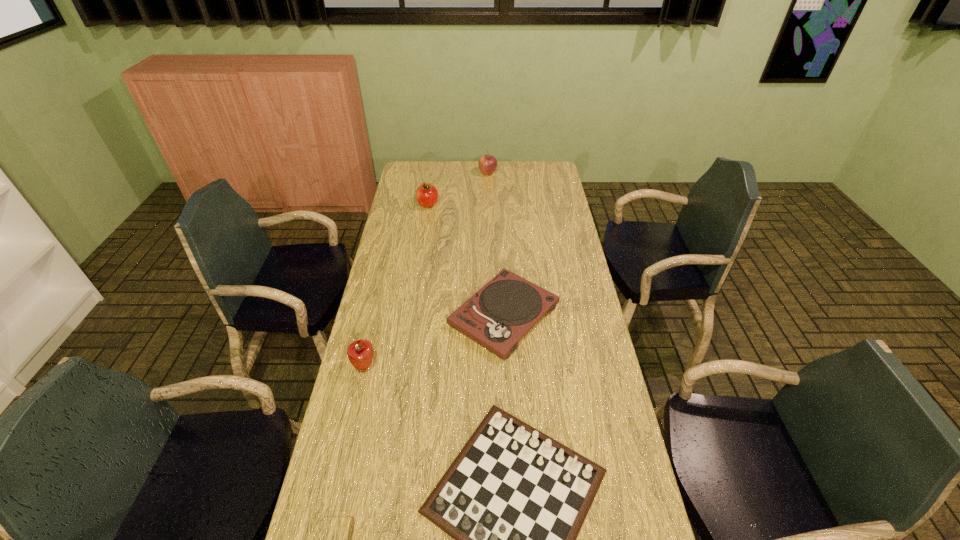
At what (x,y) coordinates should I click in order to perform the action: click on the rightmost apple. Please return your answer as a coordinate pair (x, y). The image size is (960, 540). Looking at the image, I should click on (487, 164).

Locate an element on the screen. The width and height of the screenshot is (960, 540). the farthest apple is located at coordinates (487, 164).

In order to click on the second farthest object in this screenshot , I will do `click(426, 195)`.

I want to click on the second nearest apple, so click(426, 195).

Locate an element on the screen. Image resolution: width=960 pixels, height=540 pixels. the leftmost apple is located at coordinates (360, 353).

At what (x,y) coordinates should I click in order to perform the action: click on phonograph_record. Please return your answer as a coordinate pair (x, y). Looking at the image, I should click on (497, 316).

At what (x,y) coordinates should I click in order to perform the action: click on vacant space located 0.050m on the right of the farthest object. Please return your answer as a coordinate pair (x, y). Looking at the image, I should click on (507, 173).

I want to click on vacant area situated 0.320m on the front of the second farthest object, so click(420, 255).

Where is `free spot located 0.270m on the back of the leftmost apple`? The width and height of the screenshot is (960, 540). free spot located 0.270m on the back of the leftmost apple is located at coordinates (380, 296).

The height and width of the screenshot is (540, 960). In order to click on vacant area situated on the right of the phonograph_record in this screenshot , I will do `click(591, 315)`.